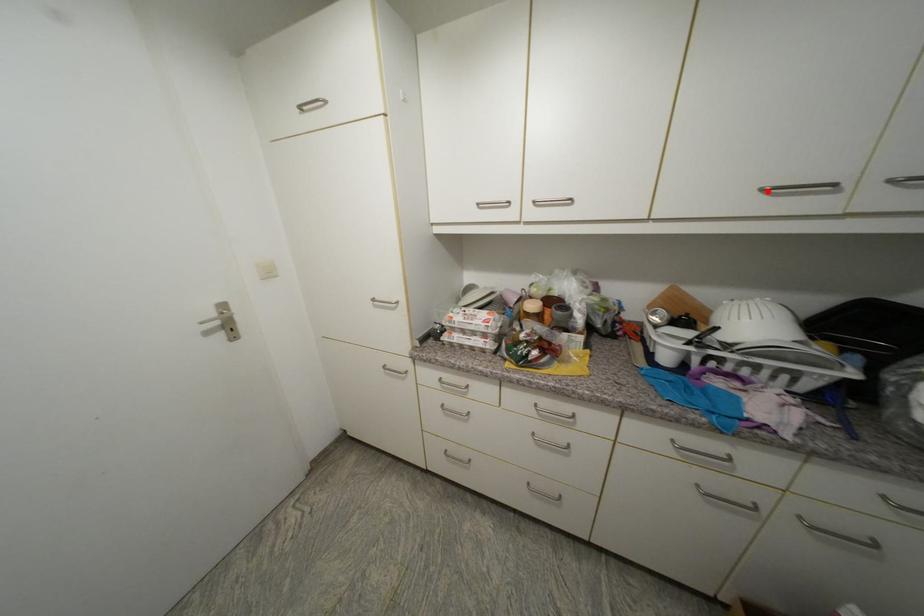
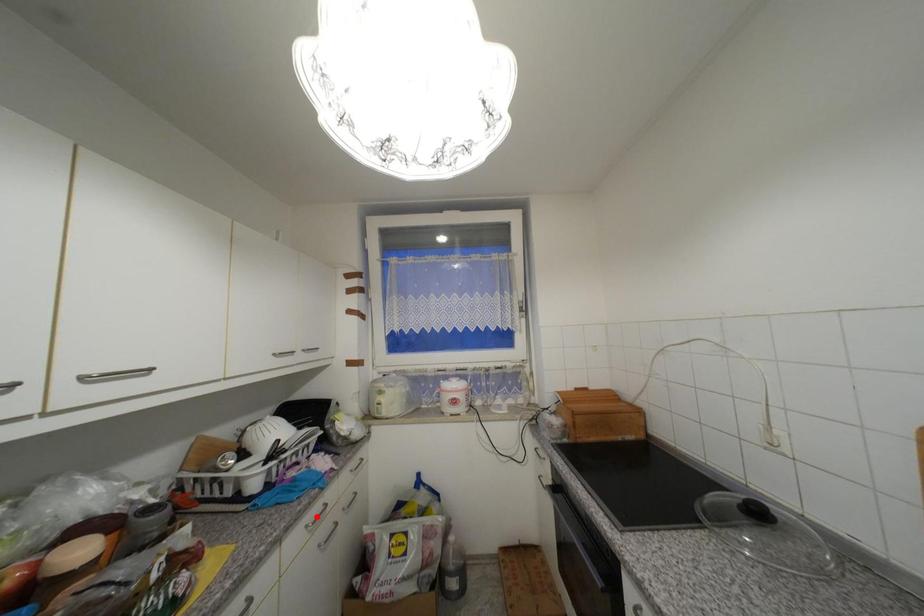
I am providing you with two images of the same scene from different viewpoints. A red point is marked on the first image and another point is marked on the second image. Is the marked point in image1 the same physical position as the marked point in image2?

No